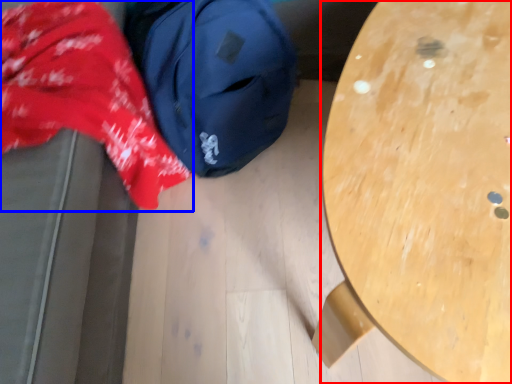
Question: Which point is closer to the camera, table (highlighted by a red box) or clothing (highlighted by a blue box)?

Choices:
 (A) table
 (B) clothing

Answer: (B)